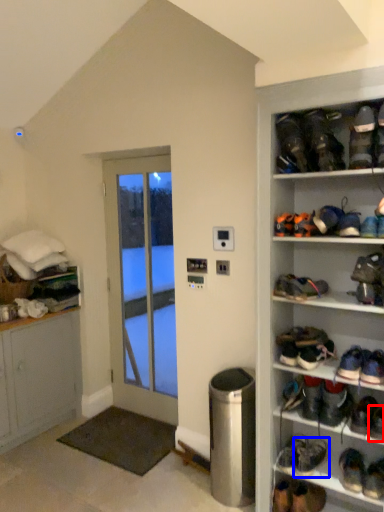
Question: Which of the following is the farthest to the observer, footwear (highlighted by a red box) or footwear (highlighted by a blue box)?

Choices:
 (A) footwear
 (B) footwear

Answer: (B)